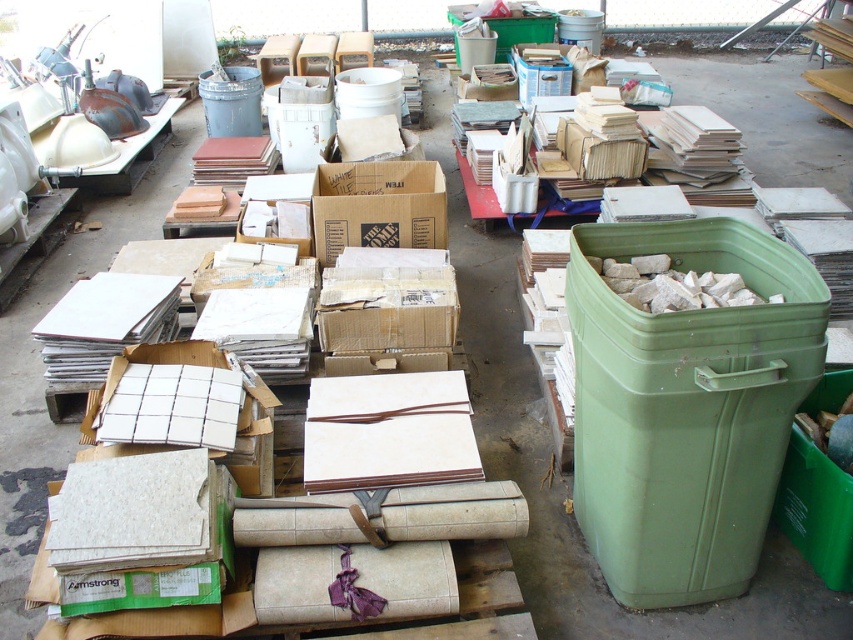
Image resolution: width=853 pixels, height=640 pixels. What do you see at coordinates (376, 205) in the screenshot?
I see `cardboard box at center` at bounding box center [376, 205].

Between cardboard box at center and metallic gray trash can at upper left, which one is positioned lower?

Positioned lower is cardboard box at center.

What do you see at coordinates (376, 205) in the screenshot?
I see `cardboard box at center` at bounding box center [376, 205].

I want to click on cardboard box at center, so click(x=376, y=205).

Locate an element on the screen. green plastic recycling bin at right is located at coordinates (686, 406).

Is point (764, 442) farther from viewer compared to point (219, 86)?

No, (764, 442) is in front of (219, 86).

Identify the location of green plastic recycling bin at right. (686, 406).

How far apart are green plastic recycling bin at right and cardboard box at center?

1.24 meters

Does green plastic recycling bin at right have a larger size compared to cardboard box at center?

Indeed, green plastic recycling bin at right has a larger size compared to cardboard box at center.

Is point (688, 316) positioned after point (344, 188)?

No, (688, 316) is closer to viewer.

Identify the location of green plastic recycling bin at right. Image resolution: width=853 pixels, height=640 pixels. (686, 406).